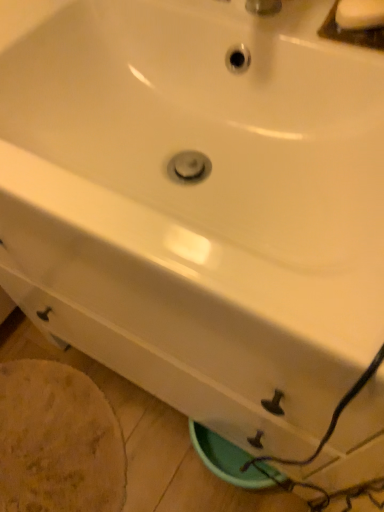
Question: Should I look upward or downward to see white matte soap at upper right?

Choices:
 (A) down
 (B) up

Answer: (B)